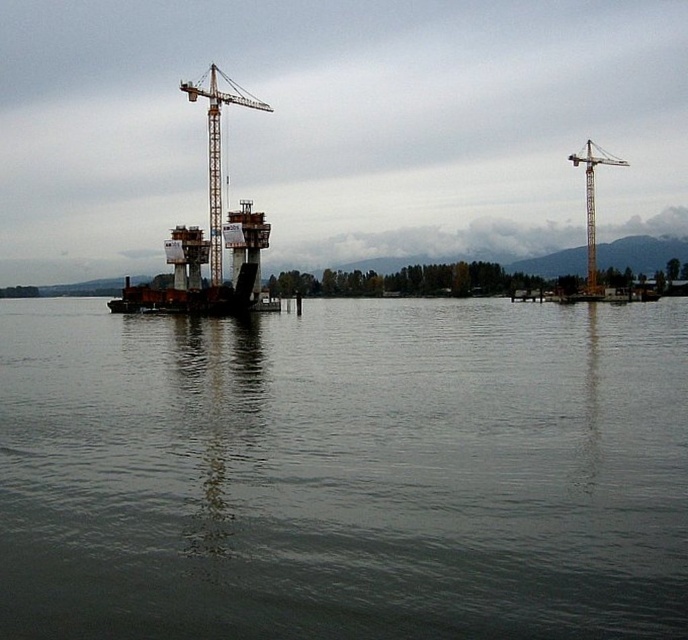
Consider the image. You are a construction worker standing on the deck of the yellow metallic crane at right. You need to lower a heavy beam into the gray matte water at center. Based on your vantage point, will the beam land closer to the crane or further away from it?

The gray matte water at center is closer to the viewer than the yellow metallic crane at right, so lowering the beam from the crane will place it closer to the crane since the water is nearer to the observer.

You are an engineer overseeing a construction project on a water body. You need to determine which crane can reach higher to lift materials over the partially constructed bridge piers. Which crane among the yellow metallic crane at center and the yellow metallic crane at right has a taller height?

The yellow metallic crane at center has a greater height compared to the yellow metallic crane at right, so it can reach higher to lift materials over the partially constructed bridge piers.